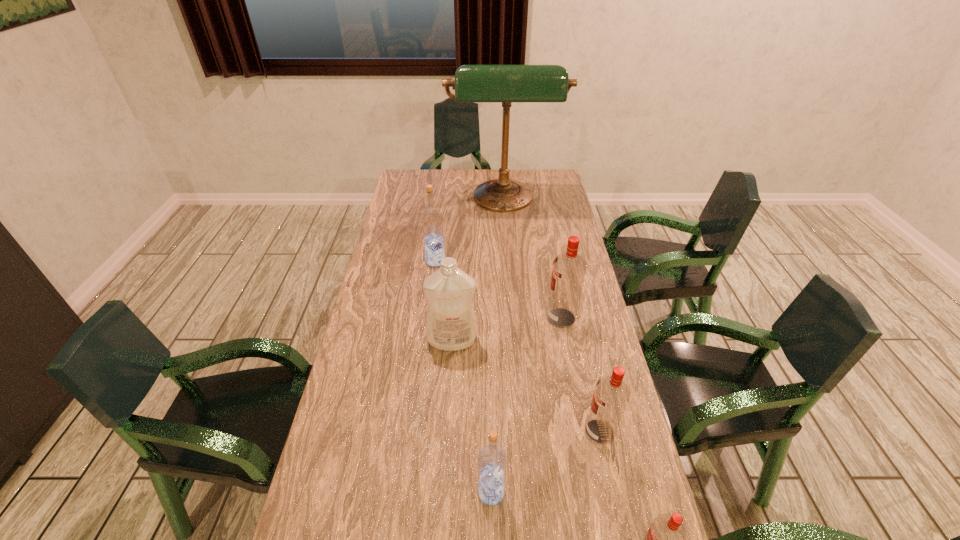
Locate an element on the screen. This screenshot has height=540, width=960. vacant region located 0.190m on the right of the second vodka from left to right is located at coordinates (592, 492).

This screenshot has width=960, height=540. I want to click on object that is at the far edge, so click(x=472, y=83).

This screenshot has width=960, height=540. Find the location of `table lamp present at the right edge`. table lamp present at the right edge is located at coordinates (472, 83).

In order to click on object located at the far right corner in this screenshot , I will do `click(472, 83)`.

Identify the location of free region at the left edge of the desktop. Image resolution: width=960 pixels, height=540 pixels. (388, 225).

Image resolution: width=960 pixels, height=540 pixels. I want to click on vacant space at the right edge of the desktop, so click(577, 364).

This screenshot has height=540, width=960. I want to click on free space at the far left corner, so click(x=404, y=189).

What are the coordinates of `vacant point located between the second smallest red vodka and the farthest red vodka` in the screenshot? It's located at (580, 375).

This screenshot has width=960, height=540. What are the coordinates of `free space between the table lamp and the right blue vodka` in the screenshot? It's located at (497, 347).

What are the coordinates of `vacant region between the green table lamp and the second nearest vodka` in the screenshot? It's located at pyautogui.click(x=497, y=347).